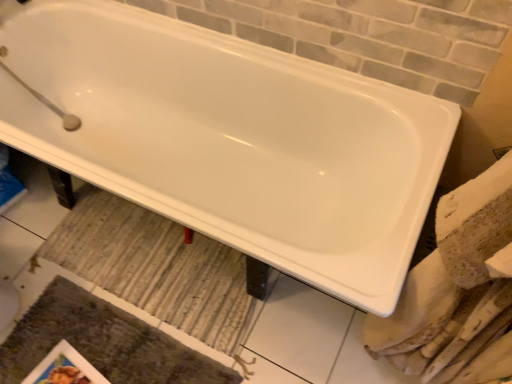
Identify the location of vacant space underneath textured gray bath mat at lower left, which is the 1th bath mat in bottom-to-top order (from a real-world perspective). The height and width of the screenshot is (384, 512). (117, 346).